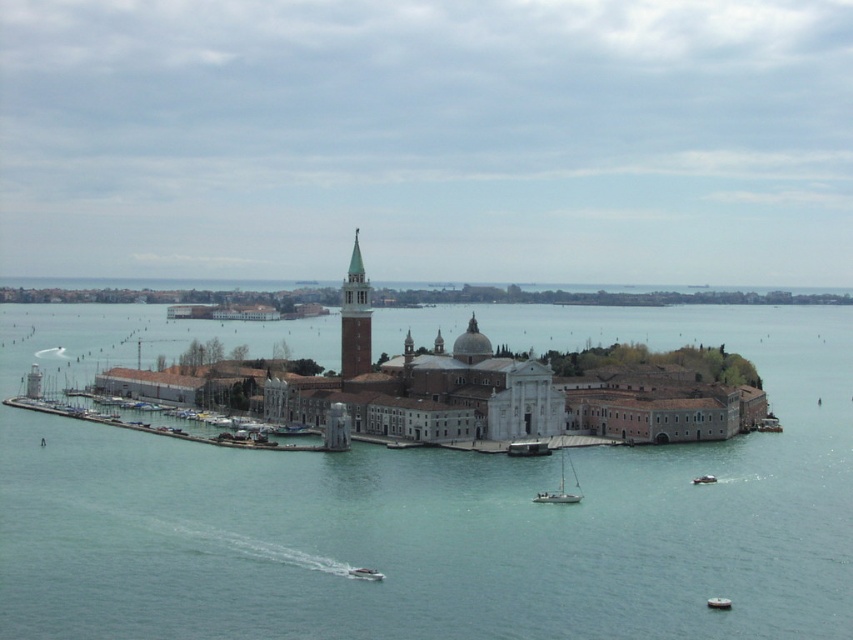
Question: Which point is farther to the camera?

Choices:
 (A) (358, 572)
 (B) (572, 472)
 (C) (283, 484)
 (D) (704, 476)

Answer: (B)

Question: Is metallic gray sailboat at center above white plastic boat at lower center?

Choices:
 (A) yes
 (B) no

Answer: (A)

Question: From the image, what is the correct spatial relationship of clear blue water at center in relation to white sailboat at lower center?

Choices:
 (A) right
 (B) left

Answer: (B)

Question: Which point is closer to the camera taking this photo?

Choices:
 (A) (372, 570)
 (B) (354, 276)

Answer: (A)

Question: Does white sailboat at lower center appear on the left side of white plastic boat at lower center?

Choices:
 (A) no
 (B) yes

Answer: (B)

Question: Which object is farther from the camera taking this photo?

Choices:
 (A) white plastic boat at lower center
 (B) white sailboat at lower center
 (C) white plastic boat at lower right

Answer: (A)